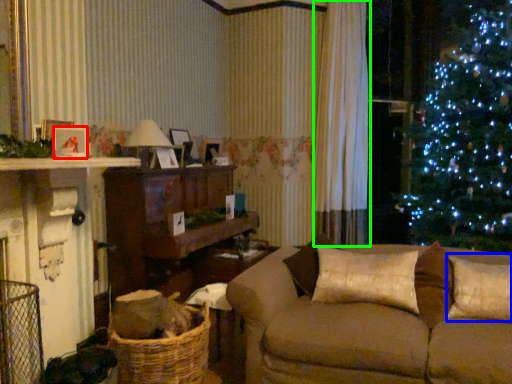
Question: Which object is the closest to the picture frame (highlighted by a red box)? Choose among these: pillow (highlighted by a blue box) or curtain (highlighted by a green box).

Choices:
 (A) pillow
 (B) curtain

Answer: (A)